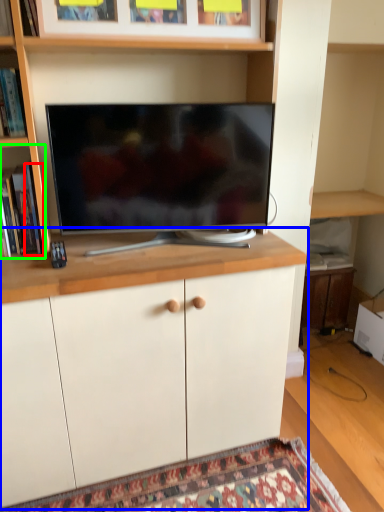
Question: Estimate the real-world distances between objects in this image. Which object is farther from book (highlighted by a red box), cabinetry (highlighted by a blue box) or shelf (highlighted by a green box)?

Choices:
 (A) cabinetry
 (B) shelf

Answer: (A)